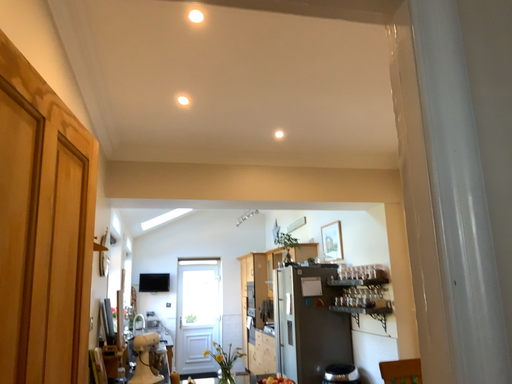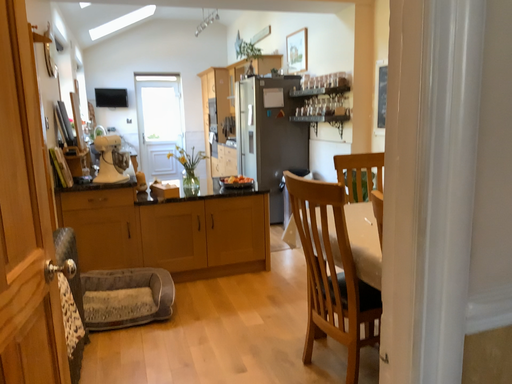
Question: Which way did the camera rotate in the video?

Choices:
 (A) rotated downward
 (B) rotated upward

Answer: (A)